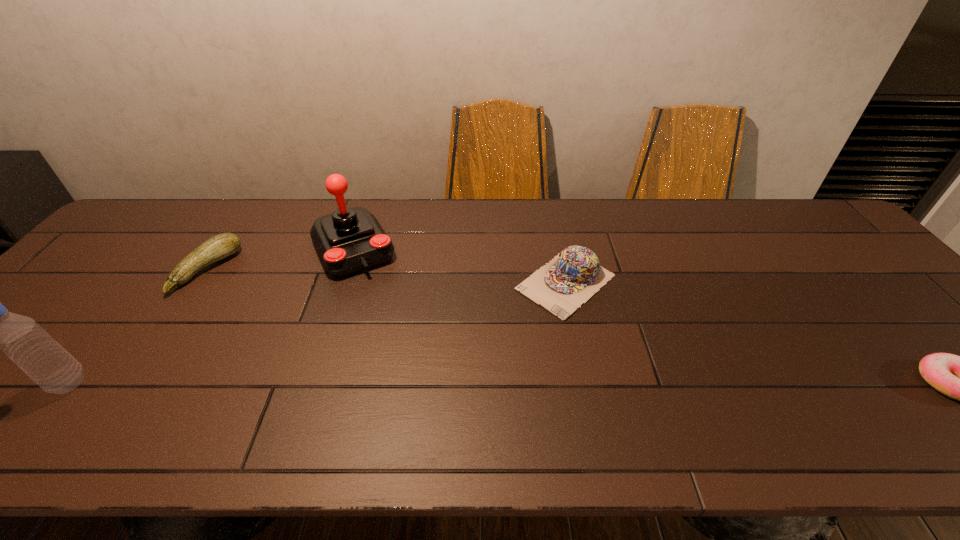
Identify the location of free space on the desktop that is between the bottle and the shortest object and is positioned on the front, side, and top of the fourth object from left to right. This screenshot has height=540, width=960. (444, 383).

Find the location of a particular element. This screenshot has width=960, height=540. free space on the desktop that is between the leftmost object and the doughnut and is positioned on the base of the joystick is located at coordinates (423, 383).

I want to click on vacant space on the desktop that is between the bottle and the doughnut and is positioned at the stem end of the fourth object from right to left, so (396, 383).